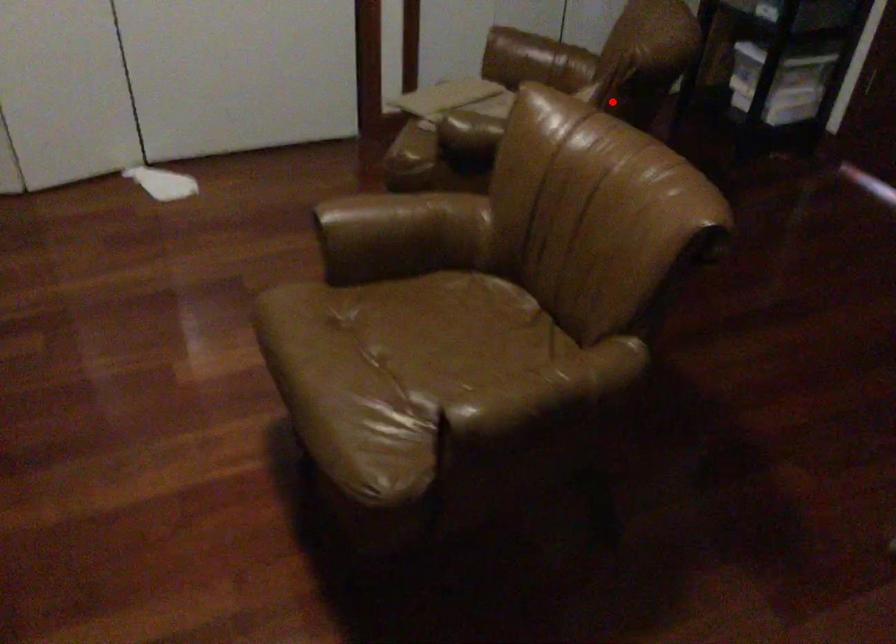
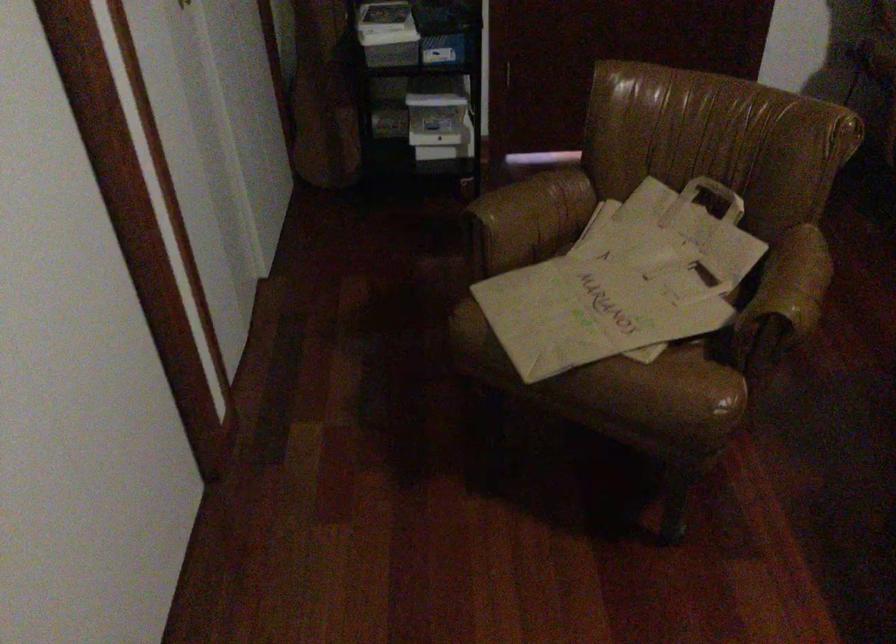
Find the pixel in the second image that matches the highlighted location in the first image.

(716, 194)